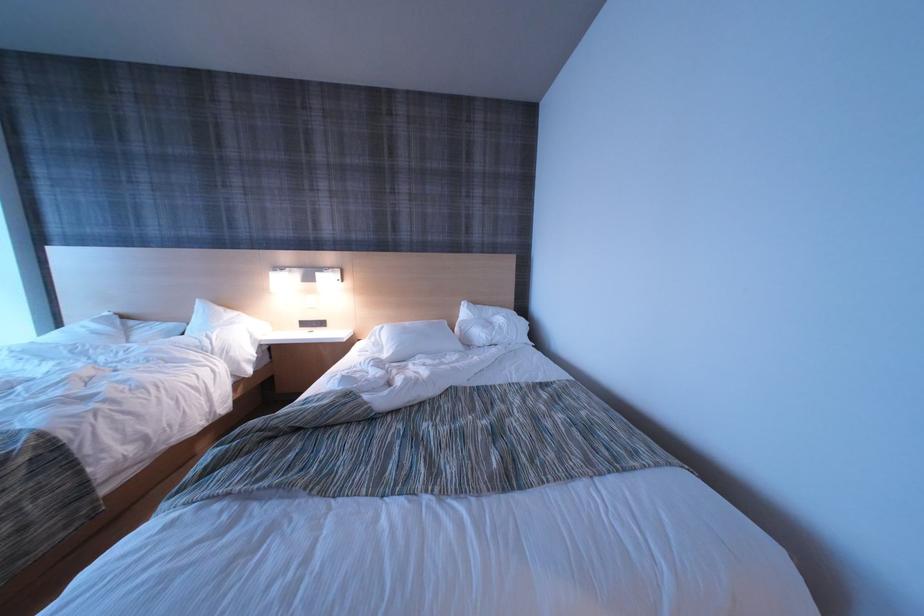
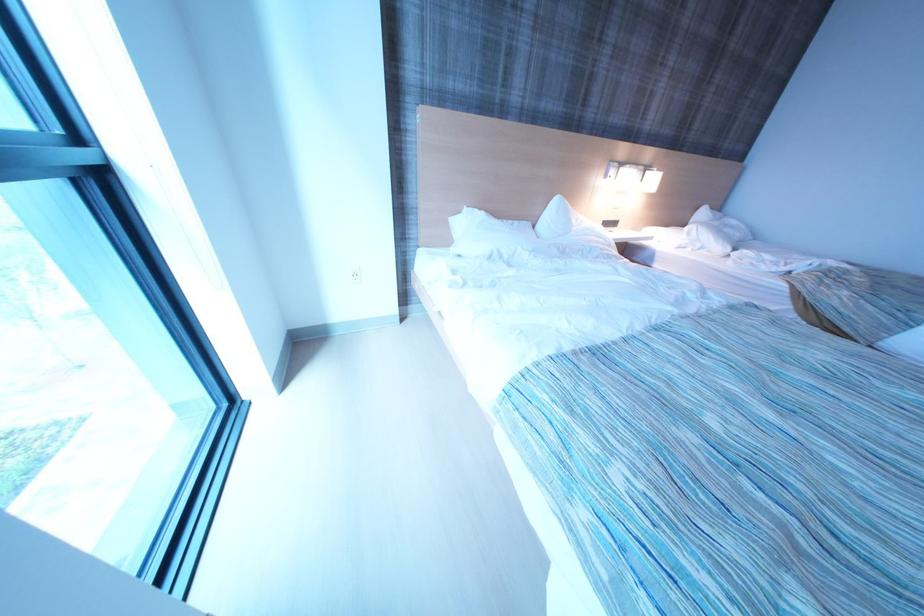
Question: Which direction would the cameraman need to move to produce the second image? Reply with the corresponding letter.

Choices:
 (A) Left
 (B) Right
 (C) Forward
 (D) Backward

Answer: (A)